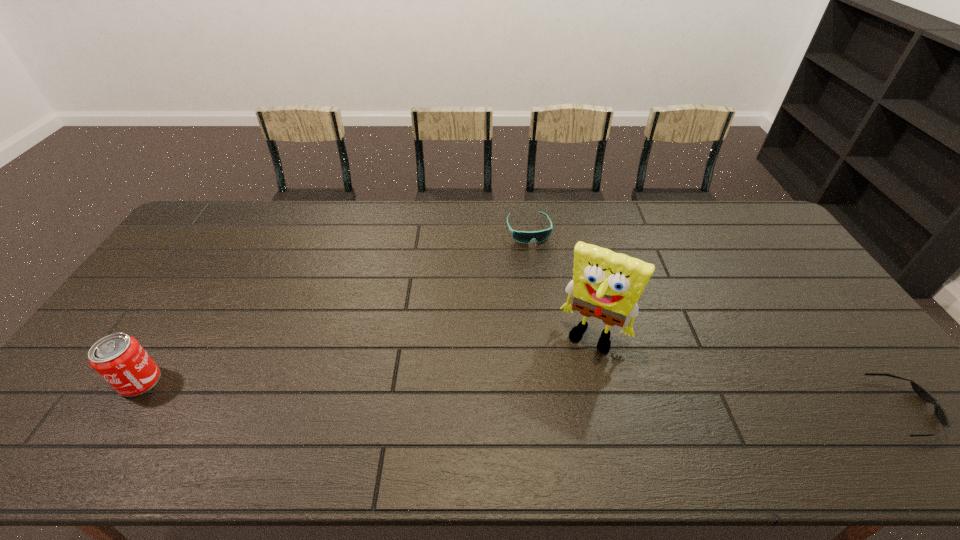
Find the location of a particular element. The height and width of the screenshot is (540, 960). vacant space located 0.070m on the front-facing side of the farther sunglasses is located at coordinates coord(538,259).

The image size is (960, 540). Identify the location of vacant space situated on the front-facing side of the farther sunglasses. (541, 271).

Identify the location of free spot located 0.160m on the face of the sponge. (560, 399).

Where is `vacant space located 0.120m on the face of the sponge`? vacant space located 0.120m on the face of the sponge is located at coordinates (565, 387).

The width and height of the screenshot is (960, 540). Identify the location of vacant area located on the face of the sponge. pyautogui.click(x=558, y=402).

Locate an element on the screen. Image resolution: width=960 pixels, height=540 pixels. object located in the far edge section of the desktop is located at coordinates (525, 237).

I want to click on can that is at the near edge, so click(119, 359).

The width and height of the screenshot is (960, 540). I want to click on sunglasses that is at the near edge, so click(x=939, y=412).

The height and width of the screenshot is (540, 960). I want to click on object that is at the left edge, so click(x=119, y=359).

Find the location of a particular element. The width and height of the screenshot is (960, 540). object that is at the right edge is located at coordinates (939, 412).